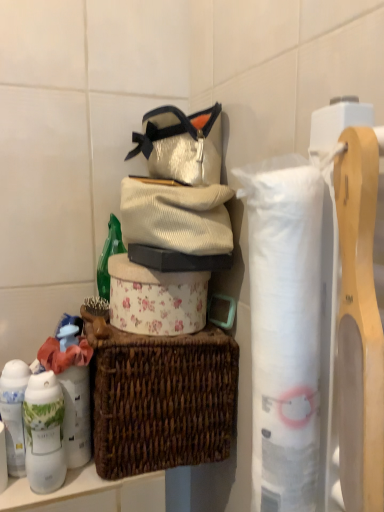
Identify the location of white paper towel at right, acting as the second toilet paper starting from the left. This screenshot has height=512, width=384. (284, 329).

What is the approximate width of brown woven picnic basket at center?

The width of brown woven picnic basket at center is 19.48 centimeters.

Identify the location of white matte toilet paper at center, acting as the first toilet paper starting from the back. The height and width of the screenshot is (512, 384). click(x=156, y=298).

Is white matte toilet paper at center, arranged as the 1th toilet paper when viewed from the left, beside white glossy lotion at lower left, the 2th toiletry viewed from the right?

No, white matte toilet paper at center, arranged as the 1th toilet paper when viewed from the left, is not in contact with white glossy lotion at lower left, the 2th toiletry viewed from the right.

Does point (154, 308) come in front of point (23, 442)?

No.

Can you confirm if white matte toilet paper at center, which ranks as the 2th toilet paper in right-to-left order, is shorter than white glossy lotion at lower left, the 2th toiletry viewed from the right?

Yes.

Which is more to the right, white glossy lotion at lower left, the 2th toiletry viewed from the right, or corduroy sweater at center?

Positioned to the right is corduroy sweater at center.

Is white glossy lotion at lower left, the 2th toiletry viewed from the right, in front of corduroy sweater at center?

No, white glossy lotion at lower left, the 2th toiletry viewed from the right, is further to the viewer.

Is corduroy sweater at center at the back of white glossy lotion at lower left, which is counted as the 1th toiletry, starting from the left?

That's not correct — white glossy lotion at lower left, which is counted as the 1th toiletry, starting from the left, is not looking away from corduroy sweater at center.

From a real-world perspective, who is located higher, white matte toilet paper at center, which is counted as the 2th toilet paper, starting from the front, or white paper towel at right, which is the 2th toilet paper from back to front?

From a 3D spatial view, white paper towel at right, which is the 2th toilet paper from back to front, is above.

From the image's perspective, which is above, white matte toilet paper at center, which ranks as the 2th toilet paper in right-to-left order, or white paper towel at right, acting as the second toilet paper starting from the left?

white matte toilet paper at center, which ranks as the 2th toilet paper in right-to-left order.

Can you confirm if white matte toilet paper at center, which ranks as the 2th toilet paper in right-to-left order, is bigger than white paper towel at right, which is the 2th toilet paper from back to front?

Correct, white matte toilet paper at center, which ranks as the 2th toilet paper in right-to-left order, is larger in size than white paper towel at right, which is the 2th toilet paper from back to front.

Is white glossy lotion at lower left, which is counted as the 1th toiletry, starting from the left, located within white paper towel at right, which is the first toilet paper from front to back?

No, white glossy lotion at lower left, which is counted as the 1th toiletry, starting from the left, is not inside white paper towel at right, which is the first toilet paper from front to back.

Does point (305, 239) come behind point (3, 368)?

No, (305, 239) is closer to viewer.

From a real-world perspective, is white paper towel at right, which is the first toilet paper from front to back, under white glossy lotion at lower left, which is counted as the 1th toiletry, starting from the left?

No, from a real-world perspective, white paper towel at right, which is the first toilet paper from front to back, is not under white glossy lotion at lower left, which is counted as the 1th toiletry, starting from the left.

At what (x,y) coordinates should I click in order to perform the action: click on the 2nd toiletry to the left of the white paper towel at right, which is the first toilet paper from front to back, counting from the anchor's position. Please return your answer as a coordinate pair (x, y). Image resolution: width=384 pixels, height=512 pixels. Looking at the image, I should click on (14, 413).

Where is `picnic basket located below the corduroy sweater at center (from the image's perspective)`? This screenshot has width=384, height=512. picnic basket located below the corduroy sweater at center (from the image's perspective) is located at coordinates 160,398.

Is corduroy sweater at center positioned with its back to brown woven picnic basket at center?

That's not correct — corduroy sweater at center is not looking away from brown woven picnic basket at center.

Consider the image. Is corduroy sweater at center further to camera compared to brown woven picnic basket at center?

No, it is not.

Is white glossy lotion at lower left, the 2th toiletry viewed from the right, located within corduroy sweater at center?

No, white glossy lotion at lower left, the 2th toiletry viewed from the right, is located outside of corduroy sweater at center.

Which object is further away from the camera taking this photo, corduroy sweater at center or white glossy lotion at lower left, the 2th toiletry viewed from the right?

white glossy lotion at lower left, the 2th toiletry viewed from the right, is further from the camera.

How many degrees apart are the facing directions of corduroy sweater at center and white glossy lotion at lower left, which is counted as the 1th toiletry, starting from the left?

They differ by 0.00138 degrees in their facing directions.

Which object is thinner, corduroy sweater at center or white glossy lotion at lower left, which is counted as the 1th toiletry, starting from the left?

With smaller width is white glossy lotion at lower left, which is counted as the 1th toiletry, starting from the left.

Is corduroy sweater at center shorter than white paper towel at right, which is the 2th toilet paper from back to front?

Correct, corduroy sweater at center is not as tall as white paper towel at right, which is the 2th toilet paper from back to front.

Can you see corduroy sweater at center touching white paper towel at right, which is the first toilet paper from front to back?

They are not placed beside each other.

Between corduroy sweater at center and white paper towel at right, acting as the second toilet paper starting from the left, which one appears on the left side from the viewer's perspective?

Positioned to the left is corduroy sweater at center.

From the image's perspective, is corduroy sweater at center above or below white paper towel at right, which is the first toilet paper from front to back?

Clearly, from the image's perspective, corduroy sweater at center is above white paper towel at right, which is the first toilet paper from front to back.

You are a GUI agent. You are given a task and a screenshot of the screen. Output one action in this format:
    pyautogui.click(x=<x>, y=<y>)
    Task: Click on the 2nd toilet paper positioned above the white glossy lotion at lower left, the 2th toiletry viewed from the right (from the image's perspective)
    This screenshot has height=512, width=384.
    Given the screenshot: What is the action you would take?
    (x=156, y=298)

Find the location of a particular element. The width and height of the screenshot is (384, 512). clothing in front of the white glossy lotion at lower left, the 2th toiletry viewed from the right is located at coordinates coord(176,217).

When comparing their distances from white matte toilet paper at center, acting as the first toilet paper starting from the back, does white matte canister at left, the 1th toiletry in the right-to-left sequence, or corduroy sweater at center seem closer?

corduroy sweater at center is closer to white matte toilet paper at center, acting as the first toilet paper starting from the back.

When comparing their distances from white glossy lotion at lower left, the 2th toiletry viewed from the right, does corduroy sweater at center or white matte canister at left, which appears as the 2th toiletry when viewed from the left, seem further?

Based on the image, corduroy sweater at center appears to be further to white glossy lotion at lower left, the 2th toiletry viewed from the right.

Which object lies further to the anchor point white paper towel at right, which is counted as the first toilet paper, starting from the right, white glossy lotion at lower left, which is counted as the 1th toiletry, starting from the left, or white matte toilet paper at center, which ranks as the 2th toilet paper in right-to-left order?

Based on the image, white glossy lotion at lower left, which is counted as the 1th toiletry, starting from the left, appears to be further to white paper towel at right, which is counted as the first toilet paper, starting from the right.

Based on their spatial positions, is corduroy sweater at center or brown woven picnic basket at center closer to white matte canister at left, the 1th toiletry in the right-to-left sequence?

Among the two, brown woven picnic basket at center is located nearer to white matte canister at left, the 1th toiletry in the right-to-left sequence.

Estimate the real-world distances between objects in this image. Which object is closer to brown woven picnic basket at center, white glossy lotion at lower left, the 2th toiletry viewed from the right, or white matte toilet paper at center, arranged as the 1th toilet paper when viewed from the left?

white matte toilet paper at center, arranged as the 1th toilet paper when viewed from the left, lies closer to brown woven picnic basket at center than the other object.

Which object lies further to the anchor point white matte toilet paper at center, which ranks as the 2th toilet paper in right-to-left order, corduroy sweater at center or white paper towel at right, which is counted as the first toilet paper, starting from the right?

Among the two, white paper towel at right, which is counted as the first toilet paper, starting from the right, is located further to white matte toilet paper at center, which ranks as the 2th toilet paper in right-to-left order.

Considering their positions, is white matte toilet paper at center, which ranks as the 2th toilet paper in right-to-left order, positioned closer to white paper towel at right, which is counted as the first toilet paper, starting from the right, than corduroy sweater at center?

Based on the image, corduroy sweater at center appears to be nearer to white paper towel at right, which is counted as the first toilet paper, starting from the right.

Estimate the real-world distances between objects in this image. Which object is closer to white paper towel at right, which is counted as the first toilet paper, starting from the right, white matte canister at left, which appears as the 2th toiletry when viewed from the left, or brown woven picnic basket at center?

Among the two, brown woven picnic basket at center is located nearer to white paper towel at right, which is counted as the first toilet paper, starting from the right.

At what (x,y) coordinates should I click in order to perform the action: click on picnic basket that lies between corduroy sweater at center and white matte canister at left, which appears as the 2th toiletry when viewed from the left, from top to bottom. Please return your answer as a coordinate pair (x, y). The height and width of the screenshot is (512, 384). Looking at the image, I should click on (160, 398).

Find the location of a particular element. The width and height of the screenshot is (384, 512). toiletry between white matte toilet paper at center, acting as the first toilet paper starting from the back, and white matte canister at left, which appears as the 2th toiletry when viewed from the left, from top to bottom is located at coordinates (14, 413).

Where is `clothing between white paper towel at right, which is the first toilet paper from front to back, and white matte toilet paper at center, arranged as the 1th toilet paper when viewed from the left, along the z-axis`? The height and width of the screenshot is (512, 384). clothing between white paper towel at right, which is the first toilet paper from front to back, and white matte toilet paper at center, arranged as the 1th toilet paper when viewed from the left, along the z-axis is located at coordinates (176, 217).

At what (x,y) coordinates should I click in order to perform the action: click on picnic basket that lies between corduroy sweater at center and white glossy lotion at lower left, which is counted as the 1th toiletry, starting from the left, from top to bottom. Please return your answer as a coordinate pair (x, y). This screenshot has width=384, height=512. Looking at the image, I should click on (160, 398).